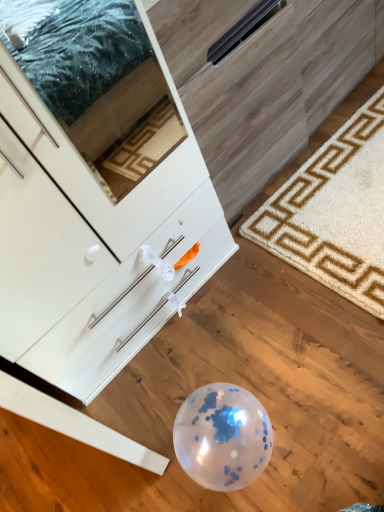
The width and height of the screenshot is (384, 512). I want to click on vacant space situated on the left part of white textured rug at lower right, so click(x=256, y=341).